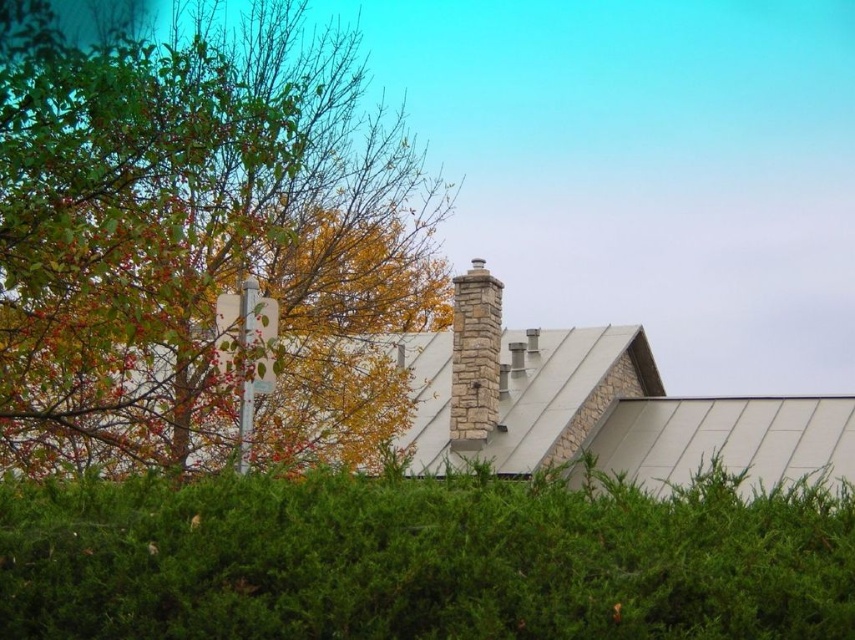
You are a gardener planning to trim the green leafy hedge at center and the stone chimney at center. Which object should you prioritize if you want to work on the shorter one first?

The green leafy hedge at center is shorter than the stone chimney at center, so you should prioritize trimming the green leafy hedge at center first.

You are standing in the garden looking at the green leafy hedge at center and the stone chimney at center. Which object is closer to the ground?

The green leafy hedge at center is closer to the ground because it is positioned under the stone chimney at center.